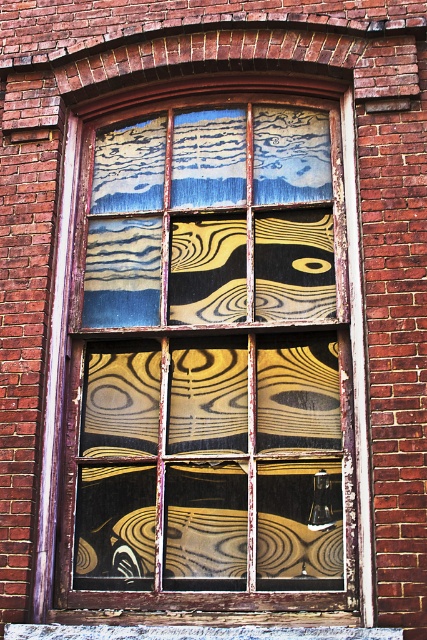
You are an architect assessing the structural integrity of the wooden window at center and the wooden at lower center. Given their heights, which one might require more reinforcement to prevent sagging?

The wooden window at center has a greater height compared to wooden at lower center, so it might require more reinforcement to prevent sagging due to its larger size.

You are standing in front of a window with a brick wall. There is a point marked at coordinates (x=207, y=356). According to the image description, what does this point correspond to?

The point at coordinates (x=207, y=356) marks the wooden window at center.

You are an interior designer assessing the space around the wooden window at center and the wooden at lower center. Which object has a narrower width?

The wooden window at center has a lesser width compared to the wooden at lower center, so the wooden window at center is narrower in width.